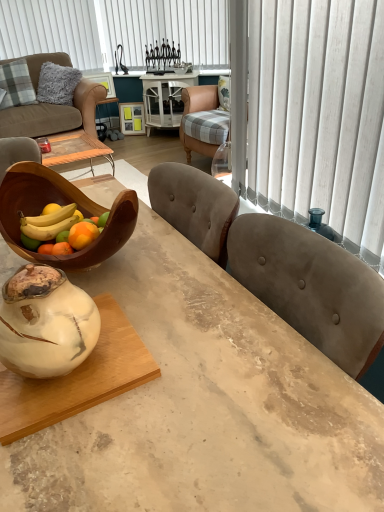
This screenshot has width=384, height=512. What do you see at coordinates (63, 204) in the screenshot? I see `wooden bowl at left` at bounding box center [63, 204].

What do you see at coordinates (165, 99) in the screenshot?
I see `white marble round table at center` at bounding box center [165, 99].

Describe the element at coordinates (115, 30) in the screenshot. I see `white vertical blinds at upper center` at that location.

Measure the distance between white marble vase at center and camera.

white marble vase at center is 27.96 inches from camera.

Where is `white marble coffee table at lower left`? The width and height of the screenshot is (384, 512). white marble coffee table at lower left is located at coordinates (77, 379).

Locate an element on the screen. The image size is (384, 512). blind above the white marble coffee table at lower left (from the image's perspective) is located at coordinates (115, 30).

Is white marble coffee table at lower left inside the boundaries of white vertical blinds at upper center, or outside?

white marble coffee table at lower left is outside white vertical blinds at upper center.

Which is closer, (36, 172) or (16, 126)?

Point (36, 172) is closer to the camera than point (16, 126).

From the image's perspective, is wooden bowl at left below brown leather couch at upper left?

Indeed, from the image's perspective, wooden bowl at left is shown beneath brown leather couch at upper left.

Does wooden bowl at left have a greater width compared to brown leather couch at upper left?

No.

Is wooden bowl at left oriented away from brown leather couch at upper left?

No, wooden bowl at left's orientation is not away from brown leather couch at upper left.

From a real-world perspective, is white marble round table at center physically below marble table at center?

Yes.

Does white marble round table at center appear on the left side of marble table at center?

No.

Does white marble round table at center touch marble table at center?

white marble round table at center is not next to marble table at center, and they're not touching.

How far apart are white marble round table at center and marble table at center?

They are 3.88 meters apart.

Is wooden bowl at left in contact with marble table at center?

No, wooden bowl at left is not beside marble table at center.

Which object is wider, wooden bowl at left or marble table at center?

marble table at center is wider.

Measure the distance from wooden bowl at left to marble table at center.

wooden bowl at left and marble table at center are 10.57 inches apart from each other.

Which is in front, point (31, 186) or point (198, 318)?

Positioned in front is point (198, 318).

Consider the image. Considering the relative positions of plaid fabric pillow at upper left and white vertical blinds at upper center in the image provided, is plaid fabric pillow at upper left to the left or to the right of white vertical blinds at upper center?

In the image, plaid fabric pillow at upper left appears on the left side of white vertical blinds at upper center.

Choose the correct answer: Is plaid fabric pillow at upper left inside white vertical blinds at upper center or outside it?

plaid fabric pillow at upper left is spatially situated outside white vertical blinds at upper center.

Is plaid fabric pillow at upper left oriented away from white vertical blinds at upper center?

No, plaid fabric pillow at upper left is not facing the opposite direction of white vertical blinds at upper center.

Is brown leather couch at upper left at the right side of plaid fabric pillow at upper left?

Correct, you'll find brown leather couch at upper left to the right of plaid fabric pillow at upper left.

Is brown leather couch at upper left far from plaid fabric pillow at upper left?

That's not correct — brown leather couch at upper left is a little close to plaid fabric pillow at upper left.

Is point (34, 85) closer to viewer compared to point (12, 76)?

No, it is behind (12, 76).

Is white marble vase at center bigger than white marble round table at center?

Incorrect, white marble vase at center is not larger than white marble round table at center.

From the picture: Who is taller, white marble vase at center or white marble round table at center?

white marble round table at center is taller.

Is point (40, 268) closer to viewer compared to point (163, 120)?

Yes, it is in front of point (163, 120).

The image size is (384, 512). Identify the location of coffee table below the white vertical blinds at upper center (from the image's perspective). (77, 379).

This screenshot has width=384, height=512. Find the location of `bowl above the brown leather couch at upper left (from a real-world perspective)`. bowl above the brown leather couch at upper left (from a real-world perspective) is located at coordinates (63, 204).

Considering their positions, is plaid fabric pillow at upper left positioned further to white marble coffee table at lower left than wooden bowl at left?

plaid fabric pillow at upper left is further to white marble coffee table at lower left.

Based on their spatial positions, is white marble vase at center or brown leather couch at upper left closer to white marble round table at center?

Among the two, brown leather couch at upper left is located nearer to white marble round table at center.

When comparing their distances from wooden bowl at left, does brown leather couch at upper left or white vertical blinds at upper center seem closer?

The object closer to wooden bowl at left is brown leather couch at upper left.

When comparing their distances from marble table at center, does white vertical blinds at upper center or plaid fabric pillow at upper left seem closer?

Among the two, plaid fabric pillow at upper left is located nearer to marble table at center.

Looking at this image, estimate the real-world distances between objects in this image. Which object is further from white marble coffee table at lower left, brown leather couch at upper left or white vertical blinds at upper center?

white vertical blinds at upper center.

Considering their positions, is marble table at center positioned further to plaid fabric pillow at upper left than brown leather couch at upper left?

Among the two, marble table at center is located further to plaid fabric pillow at upper left.

Considering their positions, is white vertical blinds at upper center positioned further to white marble vase at center than brown leather couch at upper left?

Based on the image, white vertical blinds at upper center appears to be further to white marble vase at center.

Based on their spatial positions, is white marble coffee table at lower left or white vertical blinds at upper center closer to white marble round table at center?

white vertical blinds at upper center is positioned closer to the anchor white marble round table at center.

You are a GUI agent. You are given a task and a screenshot of the screen. Output one action in this format:
    pyautogui.click(x=<x>, y=<y>)
    Task: Click on the coffee table positioned between white marble vase at center and white marble round table at center from near to far
    
    Given the screenshot: What is the action you would take?
    pyautogui.click(x=77, y=379)

You are a GUI agent. You are given a task and a screenshot of the screen. Output one action in this format:
    pyautogui.click(x=<x>, y=<y>)
    Task: Click on the blind between brown leather couch at upper left and white marble round table at center from left to right
    
    Given the screenshot: What is the action you would take?
    pyautogui.click(x=115, y=30)

Where is `studio couch positioned between marble table at center and white vertical blinds at upper center from near to far`? This screenshot has height=512, width=384. studio couch positioned between marble table at center and white vertical blinds at upper center from near to far is located at coordinates (54, 115).

I want to click on bowl between marble table at center and white marble round table at center in the front-back direction, so coord(63,204).